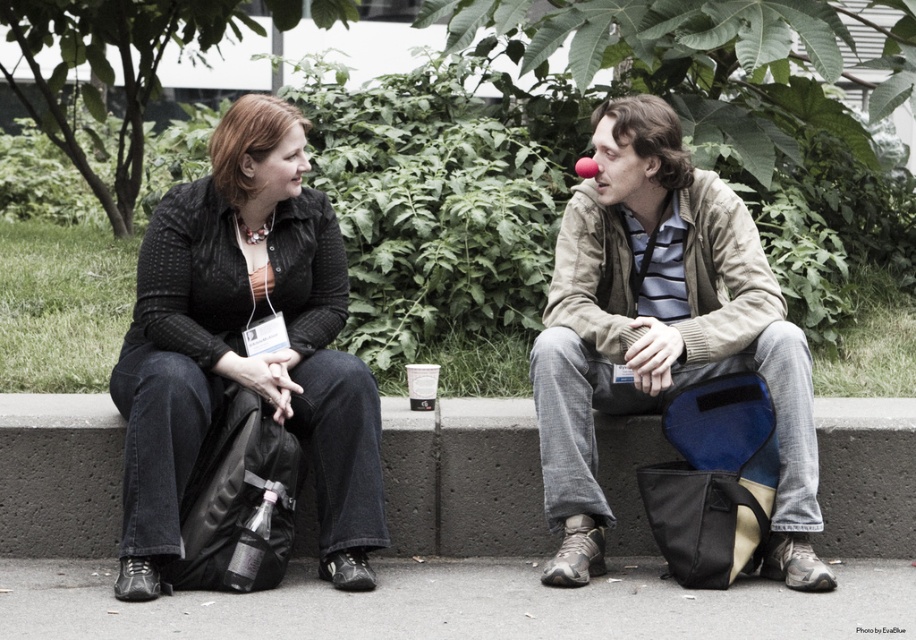
You are trying to decide which jacket to wear for a casual outdoor event. You see both the matte black jacket at center and the light beige jacket at center in the image. Which jacket is on the left side?

The matte black jacket at center is positioned on the left side of the light beige jacket at center.

You are trying to decide which jacket to wear for a rainy day. You know that the matte black jacket at center is not as tall as the light beige jacket at center. Which jacket would be more suitable for staying dry?

The light beige jacket at center is taller than the matte black jacket at center, so it would provide better coverage and be more suitable for staying dry in the rain.

You are standing in front of a public art installation and see a matte black sweater at center. If you want to touch it, will you be able to reach it without moving closer?

The matte black sweater at center is 4.70 meters away from viewer, so you cannot reach it without moving closer.